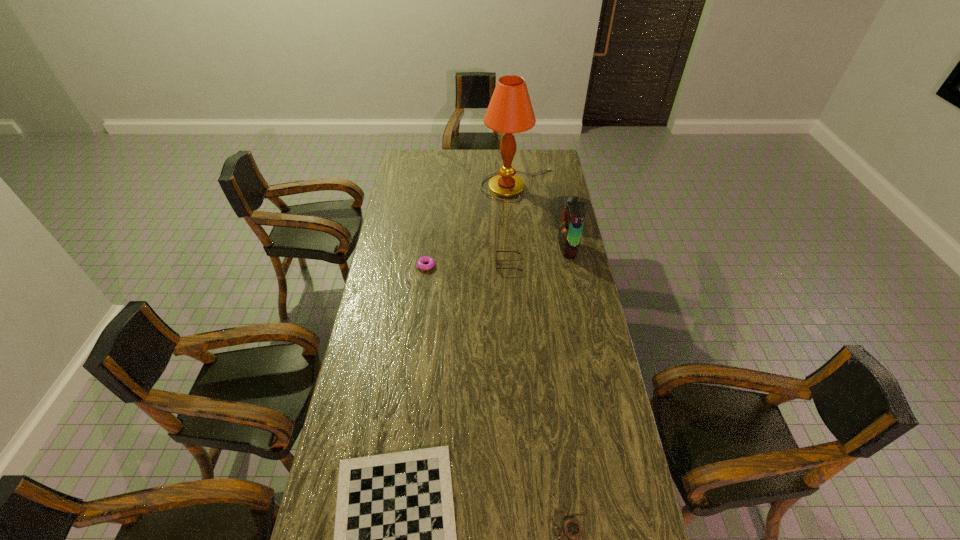
The height and width of the screenshot is (540, 960). Identify the location of vacant area located 0.340m on the front lenses of the sunglasses. (419, 265).

This screenshot has width=960, height=540. Find the location of `vacant space located 0.070m on the front lenses of the sunglasses`. vacant space located 0.070m on the front lenses of the sunglasses is located at coordinates (480, 265).

Where is `vacant point located on the front of the doughnut`? This screenshot has height=540, width=960. vacant point located on the front of the doughnut is located at coordinates (422, 296).

Find the location of `object present at the far edge`. object present at the far edge is located at coordinates (510, 111).

Where is `lamp located in the right edge section of the desktop`? Image resolution: width=960 pixels, height=540 pixels. lamp located in the right edge section of the desktop is located at coordinates (510, 111).

The image size is (960, 540). I want to click on parrot situated at the right edge, so click(x=570, y=231).

At what (x,y) coordinates should I click in order to perform the action: click on object positioned at the far right corner. Please return your answer as a coordinate pair (x, y). Looking at the image, I should click on (510, 111).

This screenshot has width=960, height=540. In the image, there is a desktop. In order to click on vacant space at the left edge in this screenshot , I will do `click(358, 450)`.

The height and width of the screenshot is (540, 960). In the image, there is a desktop. What are the coordinates of `vacant region at the right edge` in the screenshot? It's located at (572, 275).

Where is `vacant point located between the tallest object and the doughnut`? vacant point located between the tallest object and the doughnut is located at coordinates (472, 225).